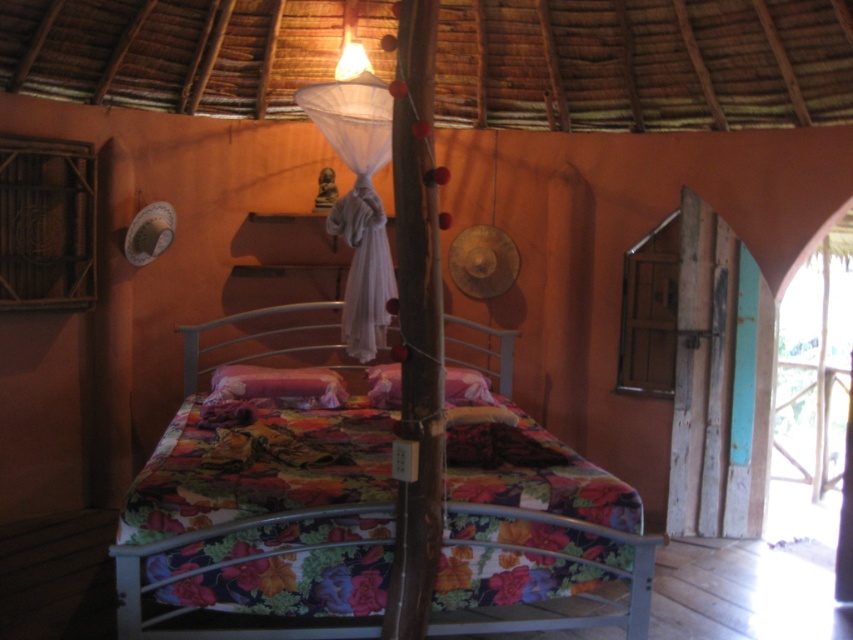
You are a delivery person trying to place a small package between the floral fabric bed at center and the velvet pink pillow at center. The package is 24 inches long. Will it fit in the space between them?

The distance between the floral fabric bed at center and the velvet pink pillow at center is 25.54 inches. Since the package is 24 inches long, it will fit in the space between them as there is enough room.

You are standing at the entrance of the bedroom and want to place a new rug in the center of the room. Given the floral fabric bed at center is positioned at coordinates 0.817 on the x and 0.308 on the y axis, where should you place the rug to ensure it is centered relative to the bed?

The floral fabric bed at center is located at point (x=262, y=522). To center the rug relative to the bed, place it at the same coordinates, 0.817 on the x and 0.308 on the y axis.

You are standing in the rustic bedroom and want to place two decorative items on the floor. The first item must be placed at point (523, 525) and the second at point (292, 388). Which point is closer to you when you are facing the bed?

Point (523, 525) is closer to the viewer than point (292, 388).